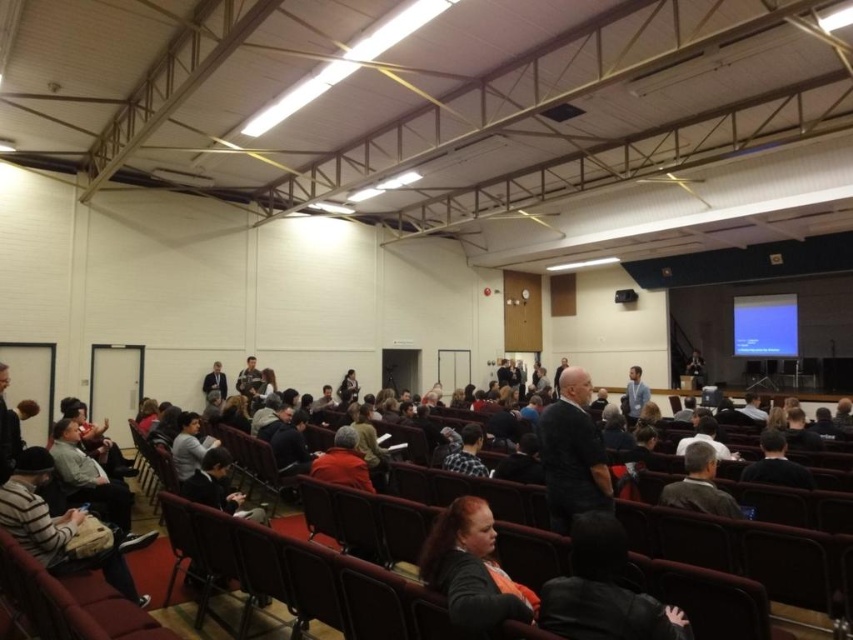
Between striped knit sweater at lower left and plaid fabric shirt at center, which one is positioned lower?

Positioned lower is striped knit sweater at lower left.

Who is more distant from viewer, (51, 515) or (474, 472)?

The point (474, 472) is behind.

Where is `striped knit sweater at lower left`? This screenshot has width=853, height=640. striped knit sweater at lower left is located at coordinates coord(56,525).

Which is more to the left, dark gray sweater at center or light blue shirt at center?

Positioned to the left is dark gray sweater at center.

Which is behind, point (172, 445) or point (625, 396)?

Positioned behind is point (625, 396).

Does point (196, 420) come closer to viewer compared to point (627, 413)?

Yes, point (196, 420) is closer to viewer.

Locate an element on the screen. The image size is (853, 640). dark gray sweater at center is located at coordinates (189, 445).

Can you confirm if gray wool sweater at center is positioned to the right of plaid fabric shirt at center?

Correct, you'll find gray wool sweater at center to the right of plaid fabric shirt at center.

Which of these two, gray wool sweater at center or plaid fabric shirt at center, stands taller?

gray wool sweater at center is taller.

Who is more forward, (730, 509) or (467, 461)?

Point (730, 509) is more forward.

Identify the location of gray wool sweater at center. (699, 484).